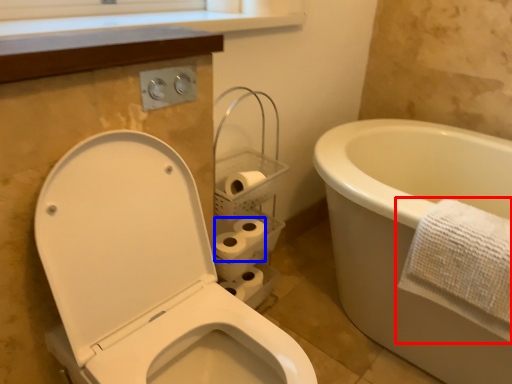
Question: Among these objects, which one is nearest to the camera, towel (highlighted by a red box) or toilet paper (highlighted by a blue box)?

Choices:
 (A) towel
 (B) toilet paper

Answer: (A)